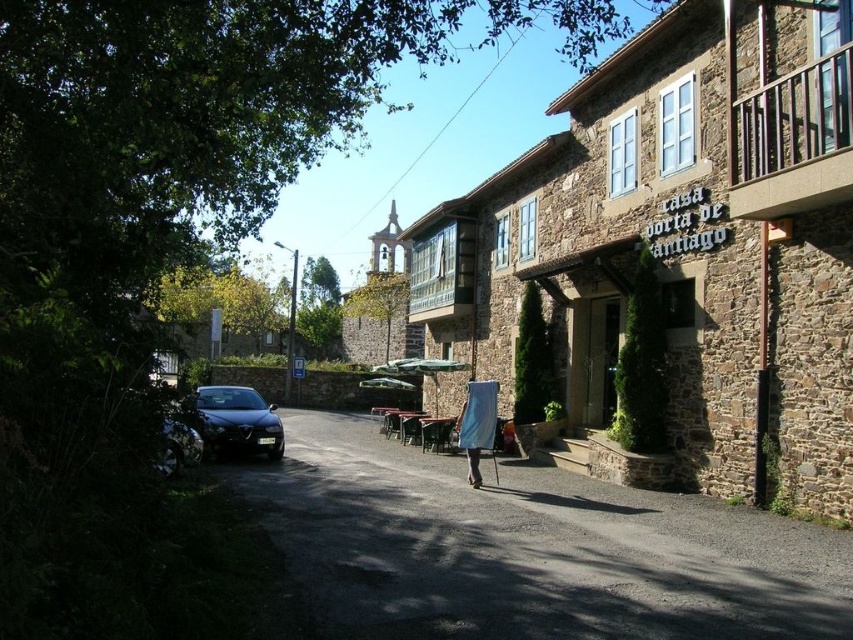
Is stone building at center thinner than dark asphalt road at center?

No.

Does point (714, 308) lie behind point (795, 529)?

Yes, point (714, 308) is behind point (795, 529).

What do you see at coordinates (682, 243) in the screenshot? This screenshot has width=853, height=640. I see `stone building at center` at bounding box center [682, 243].

The height and width of the screenshot is (640, 853). Find the location of `stone building at center`. stone building at center is located at coordinates (682, 243).

Between stone building at center and blue fabric at center, which one is positioned higher?

stone building at center

Does stone building at center appear on the left side of blue fabric at center?

Correct, you'll find stone building at center to the left of blue fabric at center.

Measure the distance between stone building at center and camera.

8.49 meters

The image size is (853, 640). I want to click on stone building at center, so click(x=682, y=243).

Does point (372, 512) come behind point (459, 417)?

That is False.

Between dark asphalt road at center and blue fabric at center, which one is positioned higher?

blue fabric at center is higher up.

Is point (276, 545) less distant than point (492, 385)?

Yes.

Locate an element on the screen. This screenshot has height=640, width=853. dark asphalt road at center is located at coordinates (529, 548).